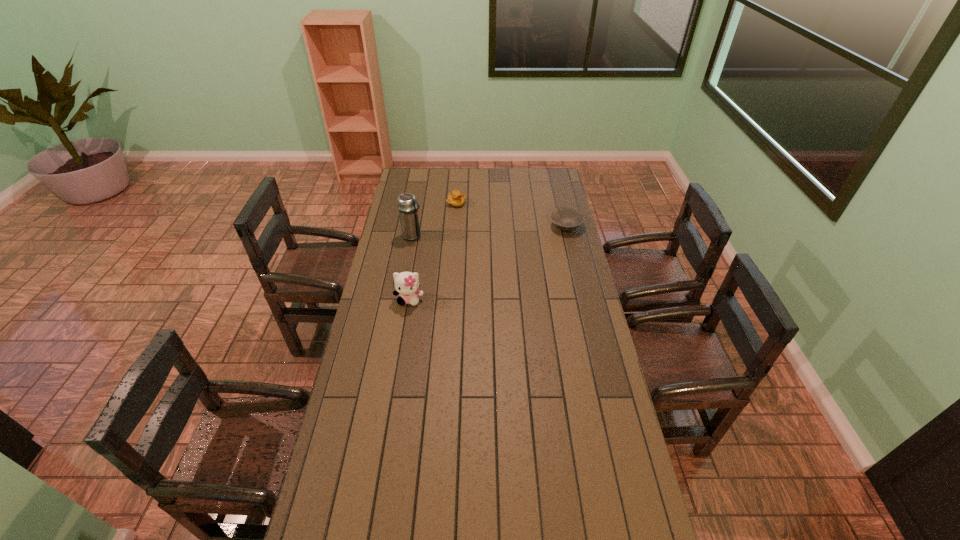
At what (x,y) coordinates should I click in order to perform the action: click on the third shortest object. Please return your answer as a coordinate pair (x, y). Image resolution: width=960 pixels, height=540 pixels. Looking at the image, I should click on (406, 284).

This screenshot has width=960, height=540. Find the location of `the nearest object`. the nearest object is located at coordinates (406, 284).

Image resolution: width=960 pixels, height=540 pixels. Identify the location of bowl. (565, 218).

The image size is (960, 540). I want to click on the shortest object, so click(565, 218).

In order to click on duckling in this screenshot , I will do `click(455, 198)`.

Image resolution: width=960 pixels, height=540 pixels. I want to click on the third object from left to right, so click(x=455, y=198).

Where is `thermos bottle`? thermos bottle is located at coordinates (408, 210).

Where is `free region located on the front-facing side of the second tallest object`? free region located on the front-facing side of the second tallest object is located at coordinates (405, 322).

Identify the location of free location located 0.400m on the back of the bowl. (554, 177).

Identify the location of free space located 0.270m at the beak of the duckling. (485, 236).